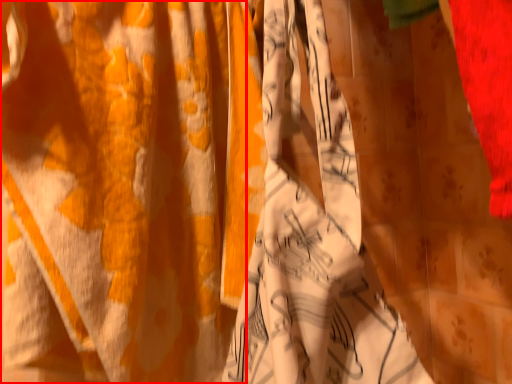
Question: From the image's perspective, where is curtain (annotated by the red box) located in relation to clothing in the image?

Choices:
 (A) below
 (B) above

Answer: (B)